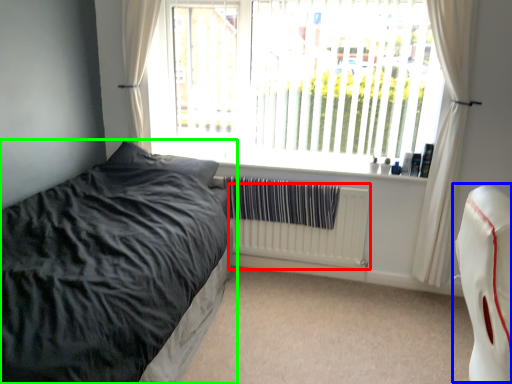
Question: Estimate the real-world distances between objects in this image. Which object is closer to radiator (highlighted by a red box), swivel chair (highlighted by a blue box) or bed (highlighted by a green box)?

Choices:
 (A) swivel chair
 (B) bed

Answer: (B)